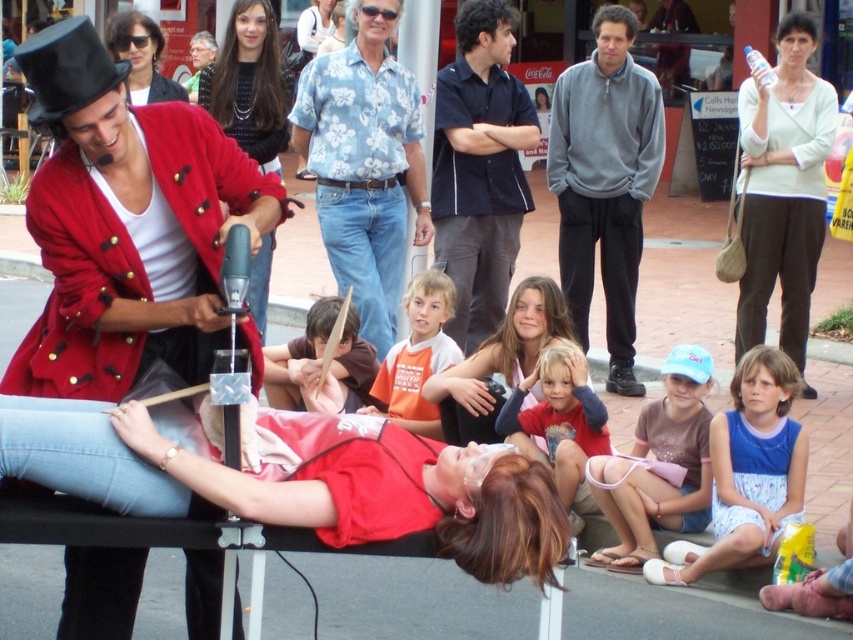
Consider the image. Who is more forward, (521, 140) or (134, 80)?

Point (134, 80) is in front.

Between point (467, 348) and point (148, 44), which one is positioned in front?

Point (467, 348) is more forward.

I want to click on dark blue shirt at center, so click(479, 168).

Is point (143, 193) farther from viewer compared to point (132, 10)?

No, it is not.

Which is more to the right, red velvet coat at center or matte black sunglasses at upper left?

red velvet coat at center is more to the right.

The height and width of the screenshot is (640, 853). What are the coordinates of `red velvet coat at center` in the screenshot? It's located at (126, 225).

Which is in front, point (369, 276) or point (459, 260)?

Point (369, 276) is in front.

Who is lower down, blue floral shirt at center or dark blue shirt at center?

Positioned lower is blue floral shirt at center.

This screenshot has width=853, height=640. Find the location of `blue floral shirt at center`. blue floral shirt at center is located at coordinates (364, 164).